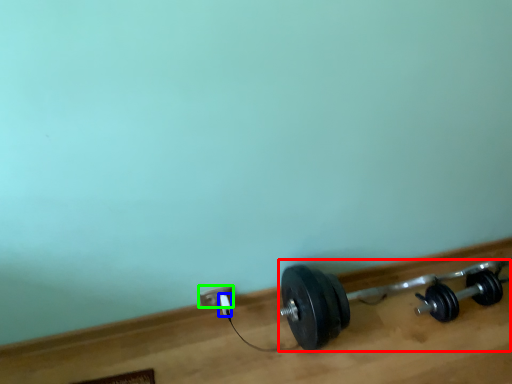
Question: Estimate the real-world distances between objects in this image. Which object is closer to dumbbell (highlighted by a red box), plug (highlighted by a blue box) or power plugs and sockets (highlighted by a green box)?

Choices:
 (A) plug
 (B) power plugs and sockets

Answer: (B)